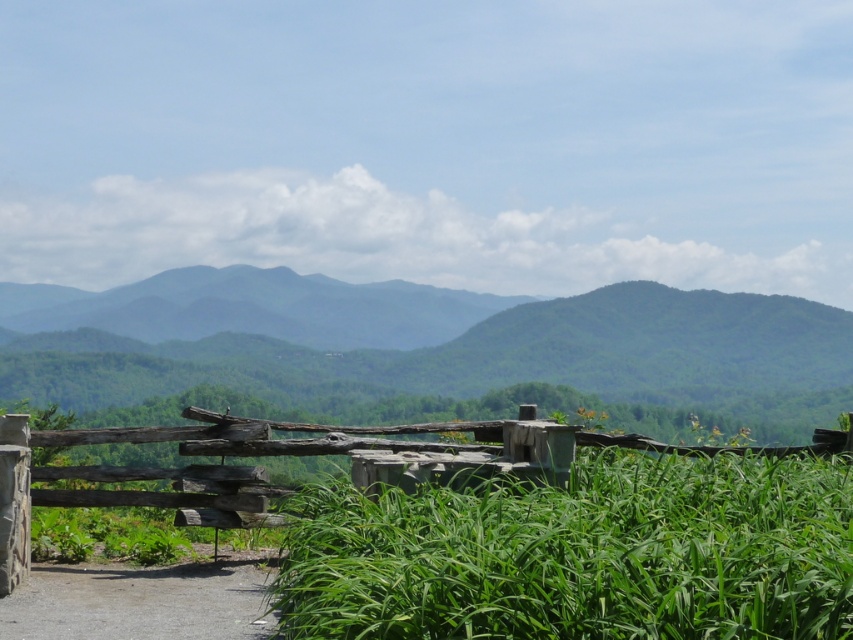
You are standing in the middle of the green grassy field at center and want to walk towards the green textured mountain at center. Which direction should you walk to reach it?

Since the green grassy field at center is positioned on the right side of the green textured mountain at center, you should walk to the left to reach the mountain.